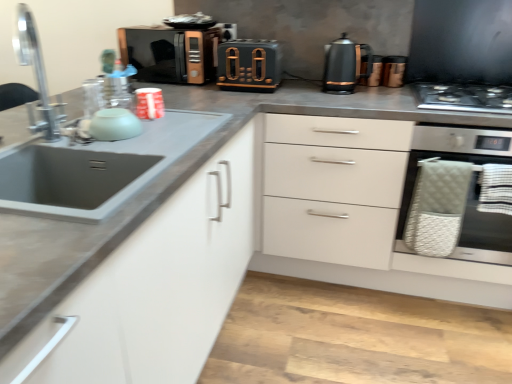
Find the location of `empty space that is to the right of matte black kettle at upper right`. empty space that is to the right of matte black kettle at upper right is located at coordinates (390, 86).